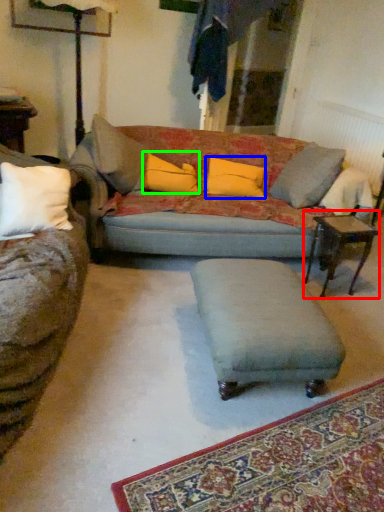
Question: Considering the real-world distances, which object is farthest from table (highlighted by a red box)? pillow (highlighted by a blue box) or pillow (highlighted by a green box)?

Choices:
 (A) pillow
 (B) pillow

Answer: (B)